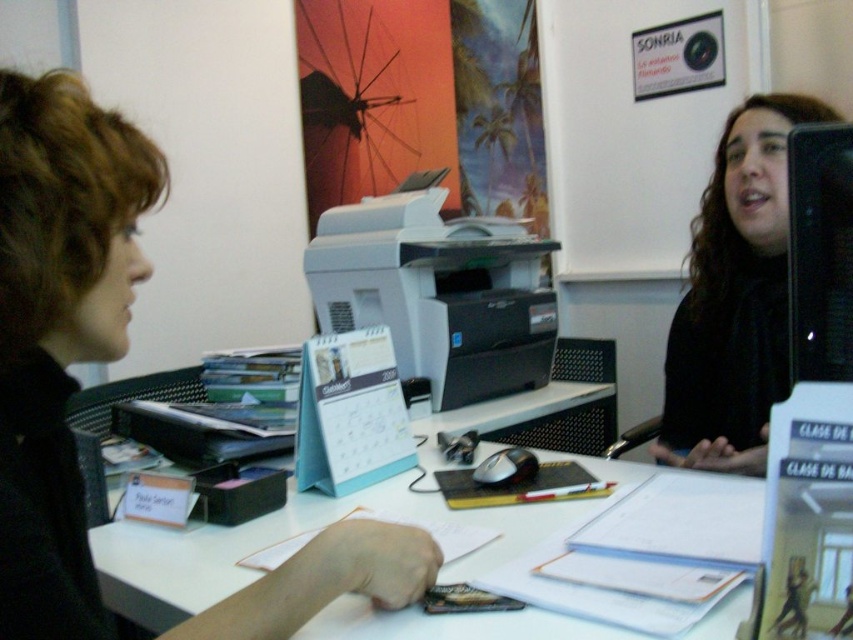
Which of these two, matte black hair at left or black glossy monitor at upper right, stands shorter?

Standing shorter between the two is black glossy monitor at upper right.

From the picture: Is matte black hair at left wider than black glossy monitor at upper right?

Correct, the width of matte black hair at left exceeds that of black glossy monitor at upper right.

Who is more distant from viewer, (67,209) or (801,164)?

The point (801,164) is more distant.

Identify the location of matte black hair at left. (59, 330).

Who is positioned more to the right, matte black hair at left or black matte shirt at center?

From the viewer's perspective, black matte shirt at center appears more on the right side.

Is matte black hair at left positioned at the back of black matte shirt at center?

No.

Is point (90, 332) farther from viewer compared to point (685, 362)?

No, (90, 332) is closer to viewer.

The height and width of the screenshot is (640, 853). In order to click on matte black hair at left in this screenshot , I will do `click(59, 330)`.

Which of these two, black matte shirt at center or black glossy monitor at upper right, stands shorter?

black glossy monitor at upper right

Identify the location of black matte shirt at center. Image resolution: width=853 pixels, height=640 pixels. (735, 296).

Find the location of a particular element. The width and height of the screenshot is (853, 640). black matte shirt at center is located at coordinates (735, 296).